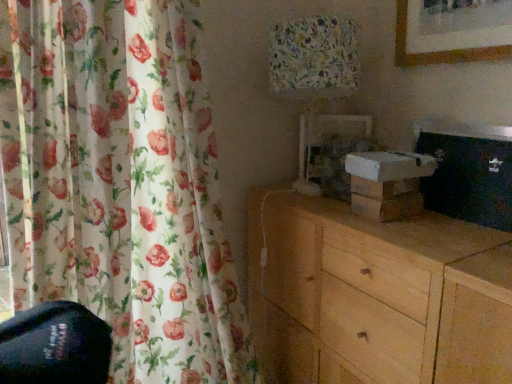
You are a GUI agent. You are given a task and a screenshot of the screen. Output one action in this format:
    pyautogui.click(x=<x>, y=<y>)
    Task: Click on the floral fabric curtain at left
    The image size is (512, 384).
    Given the screenshot: What is the action you would take?
    (x=120, y=183)

Locate an element on the screen. light wood chest of drawers at lower right is located at coordinates (375, 295).

The image size is (512, 384). I want to click on floral fabric curtain at left, so click(120, 183).

Is floral fabric curtain at left completely or partially inside light wood chest of drawers at lower right?

No.

Between light wood chest of drawers at lower right and floral fabric curtain at left, which one is positioned behind?

floral fabric curtain at left is behind.

Is light wood chest of drawers at lower right in contact with floral fabric curtain at left?

No, light wood chest of drawers at lower right is not in contact with floral fabric curtain at left.

Considering the relative sizes of light wood chest of drawers at lower right and floral fabric curtain at left in the image provided, is light wood chest of drawers at lower right shorter than floral fabric curtain at left?

Yes, light wood chest of drawers at lower right is shorter than floral fabric curtain at left.

Considering the points (309, 17) and (485, 295), which point is in front, point (309, 17) or point (485, 295)?

The point (485, 295) is closer to the camera.

Is floral fabric lampshade at upper center positioned beyond the bounds of light wood chest of drawers at lower right?

Indeed, floral fabric lampshade at upper center is completely outside light wood chest of drawers at lower right.

From the image's perspective, would you say floral fabric lampshade at upper center is positioned over light wood chest of drawers at lower right?

Yes, from the image's perspective, floral fabric lampshade at upper center is on top of light wood chest of drawers at lower right.

Would you consider floral fabric lampshade at upper center to be distant from light wood chest of drawers at lower right?

No.

Is floral fabric curtain at left directly adjacent to light wood chest of drawers at lower right?

No, floral fabric curtain at left is not next to light wood chest of drawers at lower right.

Can you confirm if floral fabric curtain at left is shorter than light wood chest of drawers at lower right?

No, floral fabric curtain at left is not shorter than light wood chest of drawers at lower right.

Measure the distance from floral fabric curtain at left to light wood chest of drawers at lower right.

17.22 inches.

Can we say floral fabric curtain at left lies outside light wood chest of drawers at lower right?

Yes, floral fabric curtain at left is outside of light wood chest of drawers at lower right.

Consider the image. Which object is positioned more to the right, floral fabric lampshade at upper center or floral fabric curtain at left?

From the viewer's perspective, floral fabric lampshade at upper center appears more on the right side.

Is floral fabric lampshade at upper center inside or outside of floral fabric curtain at left?

floral fabric lampshade at upper center exists outside the volume of floral fabric curtain at left.

Is floral fabric curtain at left at the back of floral fabric lampshade at upper center?

No, floral fabric lampshade at upper center is not facing away from floral fabric curtain at left.

You are a GUI agent. You are given a task and a screenshot of the screen. Output one action in this format:
    pyautogui.click(x=<x>, y=<y>)
    Task: Click on the table lamp that appears above the floral fabric curtain at left (from the image's perspective)
    Image resolution: width=512 pixels, height=384 pixels.
    Given the screenshot: What is the action you would take?
    pyautogui.click(x=313, y=71)

Which is in front, point (394, 278) or point (308, 169)?

The point (394, 278) is in front.

Is floral fabric lampshade at upper center at the back of light wood chest of drawers at lower right?

No, light wood chest of drawers at lower right is not facing the opposite direction of floral fabric lampshade at upper center.

Does light wood chest of drawers at lower right lie in front of floral fabric lampshade at upper center?

That is True.

From the image's perspective, between floral fabric curtain at left and floral fabric lampshade at upper center, which one is located above?

floral fabric lampshade at upper center appears higher in the image.

Which of these two, floral fabric curtain at left or floral fabric lampshade at upper center, is thinner?

Thinner between the two is floral fabric lampshade at upper center.

Which is more to the left, floral fabric curtain at left or floral fabric lampshade at upper center?

From the viewer's perspective, floral fabric curtain at left appears more on the left side.

Identify the location of table lamp lying behind the floral fabric curtain at left. (313, 71).

In the image, there is a floral fabric curtain at left. Identify the location of the chest of drawers below it (from the image's perspective). (375, 295).

Where is `table lamp that is behind the light wood chest of drawers at lower right`? table lamp that is behind the light wood chest of drawers at lower right is located at coordinates (313, 71).

Based on their spatial positions, is floral fabric curtain at left or light wood chest of drawers at lower right closer to floral fabric lampshade at upper center?

light wood chest of drawers at lower right lies closer to floral fabric lampshade at upper center than the other object.

From the image, which object appears to be nearer to floral fabric lampshade at upper center, light wood chest of drawers at lower right or floral fabric curtain at left?

Among the two, light wood chest of drawers at lower right is located nearer to floral fabric lampshade at upper center.

From the image, which object appears to be farther from light wood chest of drawers at lower right, floral fabric curtain at left or floral fabric lampshade at upper center?

Among the two, floral fabric curtain at left is located further to light wood chest of drawers at lower right.

From the image, which object appears to be farther from floral fabric curtain at left, floral fabric lampshade at upper center or light wood chest of drawers at lower right?

Based on the image, floral fabric lampshade at upper center appears to be further to floral fabric curtain at left.

Considering their positions, is floral fabric lampshade at upper center positioned closer to light wood chest of drawers at lower right than floral fabric curtain at left?

floral fabric lampshade at upper center.

Based on their spatial positions, is light wood chest of drawers at lower right or floral fabric lampshade at upper center further from floral fabric curtain at left?

Based on the image, floral fabric lampshade at upper center appears to be further to floral fabric curtain at left.

Identify the location of curtain between floral fabric lampshade at upper center and light wood chest of drawers at lower right in the vertical direction. (120, 183).